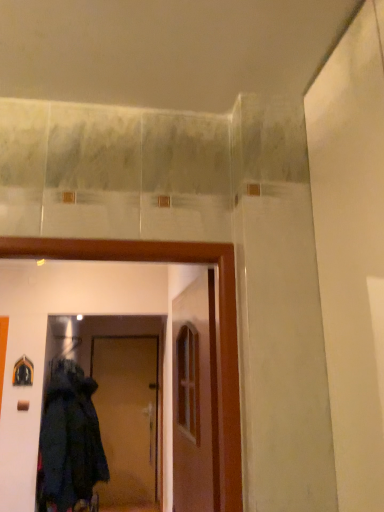
What is the approximate width of wooden door at center, arranged as the first door when viewed from the front?

The width of wooden door at center, arranged as the first door when viewed from the front, is 1.49 inches.

This screenshot has width=384, height=512. Describe the element at coordinates (127, 417) in the screenshot. I see `brown matte door at center, which ranks as the second door in front-to-back order` at that location.

Where is `dark woolen coat at lower left`? The width and height of the screenshot is (384, 512). dark woolen coat at lower left is located at coordinates (69, 442).

Are wooden door at center, the second door in the left-to-right sequence, and dark woolen coat at lower left making contact?

There is a gap between wooden door at center, the second door in the left-to-right sequence, and dark woolen coat at lower left.

Considering the relative positions of wooden door at center, the first door in the top-to-bottom sequence, and dark woolen coat at lower left in the image provided, is wooden door at center, the first door in the top-to-bottom sequence, to the left of dark woolen coat at lower left from the viewer's perspective?

No.

Consider the image. Does wooden door at center, which is the 2th door from back to front, have a greater height compared to dark woolen coat at lower left?

Incorrect, the height of wooden door at center, which is the 2th door from back to front, is not larger of that of dark woolen coat at lower left.

From the image's perspective, is wooden door at center, which is the 2th door from back to front, over dark woolen coat at lower left?

Indeed, from the image's perspective, wooden door at center, which is the 2th door from back to front, is shown above dark woolen coat at lower left.

From the picture: Which is in front, dark woolen coat at lower left or wooden door at center, marked as the second door in a bottom-to-top arrangement?

wooden door at center, marked as the second door in a bottom-to-top arrangement, is more forward.

Would you say dark woolen coat at lower left is a long distance from wooden door at center, arranged as the first door when viewed from the front?

No, dark woolen coat at lower left is not far away from wooden door at center, arranged as the first door when viewed from the front.

The width and height of the screenshot is (384, 512). In order to click on coat directly beneath the wooden door at center, the second door in the left-to-right sequence (from a real-world perspective) in this screenshot , I will do `click(69, 442)`.

Looking at the image, does dark woolen coat at lower left seem bigger or smaller compared to wooden door at center, arranged as the first door when viewed from the front?

Clearly, dark woolen coat at lower left is larger in size than wooden door at center, arranged as the first door when viewed from the front.

Would you say dark woolen coat at lower left is a long distance from brown matte door at center, which ranks as the second door in front-to-back order?

Yes, dark woolen coat at lower left and brown matte door at center, which ranks as the second door in front-to-back order, are located far from each other.

Measure the distance between dark woolen coat at lower left and brown matte door at center, which ranks as the second door in front-to-back order.

dark woolen coat at lower left and brown matte door at center, which ranks as the second door in front-to-back order, are 8.47 feet apart.

Is dark woolen coat at lower left turned away from brown matte door at center, which is the second door in right-to-left order?

That's right, dark woolen coat at lower left is facing away from brown matte door at center, which is the second door in right-to-left order.

Considering the relative positions of dark woolen coat at lower left and brown matte door at center, which appears as the 1th door when viewed from the left, in the image provided, is dark woolen coat at lower left to the right of brown matte door at center, which appears as the 1th door when viewed from the left, from the viewer's perspective?

Incorrect, dark woolen coat at lower left is not on the right side of brown matte door at center, which appears as the 1th door when viewed from the left.

Is dark woolen coat at lower left surrounded by brown matte door at center, which is the second door in right-to-left order?

No, dark woolen coat at lower left is located outside of brown matte door at center, which is the second door in right-to-left order.

Is there a large distance between brown matte door at center, which ranks as the second door in front-to-back order, and dark woolen coat at lower left?

Yes, brown matte door at center, which ranks as the second door in front-to-back order, is far from dark woolen coat at lower left.

Between brown matte door at center, the first door from the back, and dark woolen coat at lower left, which one is positioned in front?

dark woolen coat at lower left is in front.

Does brown matte door at center, the first door from the back, lie behind wooden door at center, marked as the second door in a bottom-to-top arrangement?

Yes, brown matte door at center, the first door from the back, is behind wooden door at center, marked as the second door in a bottom-to-top arrangement.

Is brown matte door at center, which ranks as the second door in front-to-back order, directly adjacent to wooden door at center, which is the first door in right-to-left order?

brown matte door at center, which ranks as the second door in front-to-back order, is not next to wooden door at center, which is the first door in right-to-left order, and they're not touching.

Does point (117, 501) come behind point (214, 383)?

Yes.

Between brown matte door at center, arranged as the first door when ordered from the bottom, and wooden door at center, which is the first door in right-to-left order, which one appears on the left side from the viewer's perspective?

brown matte door at center, arranged as the first door when ordered from the bottom.

Which is more to the left, wooden door at center, arranged as the first door when viewed from the front, or brown matte door at center, which ranks as the second door in front-to-back order?

From the viewer's perspective, brown matte door at center, which ranks as the second door in front-to-back order, appears more on the left side.

Considering the sizes of wooden door at center, the first door in the top-to-bottom sequence, and brown matte door at center, which appears as the 1th door when viewed from the left, in the image, is wooden door at center, the first door in the top-to-bottom sequence, wider or thinner than brown matte door at center, which appears as the 1th door when viewed from the left,?

In the image, wooden door at center, the first door in the top-to-bottom sequence, appears to be more narrow than brown matte door at center, which appears as the 1th door when viewed from the left.

Is wooden door at center, the second door in the left-to-right sequence, aimed at brown matte door at center, the first door from the back?

No, wooden door at center, the second door in the left-to-right sequence, is not facing towards brown matte door at center, the first door from the back.

Where is `door that is above the dark woolen coat at lower left (from a real-world perspective)`? door that is above the dark woolen coat at lower left (from a real-world perspective) is located at coordinates (195, 399).

At what (x,y) coordinates should I click in order to perform the action: click on door above the dark woolen coat at lower left (from the image's perspective). Please return your answer as a coordinate pair (x, y). Image resolution: width=384 pixels, height=512 pixels. Looking at the image, I should click on (195, 399).

When comparing their distances from dark woolen coat at lower left, does wooden door at center, which is the 2th door from back to front, or brown matte door at center, which ranks as the second door in front-to-back order, seem further?

The object further to dark woolen coat at lower left is brown matte door at center, which ranks as the second door in front-to-back order.

Based on their spatial positions, is wooden door at center, the first door in the top-to-bottom sequence, or dark woolen coat at lower left closer to brown matte door at center, which ranks as the second door in front-to-back order?

dark woolen coat at lower left lies closer to brown matte door at center, which ranks as the second door in front-to-back order, than the other object.

From the image, which object appears to be farther from brown matte door at center, which ranks as the second door in top-to-bottom order, dark woolen coat at lower left or wooden door at center, arranged as the first door when viewed from the front?

Among the two, wooden door at center, arranged as the first door when viewed from the front, is located further to brown matte door at center, which ranks as the second door in top-to-bottom order.

Considering their positions, is dark woolen coat at lower left positioned closer to wooden door at center, the second door in the left-to-right sequence, than brown matte door at center, which ranks as the second door in front-to-back order?

Among the two, dark woolen coat at lower left is located nearer to wooden door at center, the second door in the left-to-right sequence.

Which object lies further to the anchor point dark woolen coat at lower left, brown matte door at center, which ranks as the second door in front-to-back order, or wooden door at center, the first door in the top-to-bottom sequence?

Based on the image, brown matte door at center, which ranks as the second door in front-to-back order, appears to be further to dark woolen coat at lower left.

Which object lies further to the anchor point wooden door at center, marked as the second door in a bottom-to-top arrangement, brown matte door at center, arranged as the first door when ordered from the bottom, or dark woolen coat at lower left?

brown matte door at center, arranged as the first door when ordered from the bottom, is positioned further to the anchor wooden door at center, marked as the second door in a bottom-to-top arrangement.

Image resolution: width=384 pixels, height=512 pixels. I want to click on coat between wooden door at center, arranged as the first door when viewed from the front, and brown matte door at center, which ranks as the second door in front-to-back order, along the z-axis, so click(69, 442).